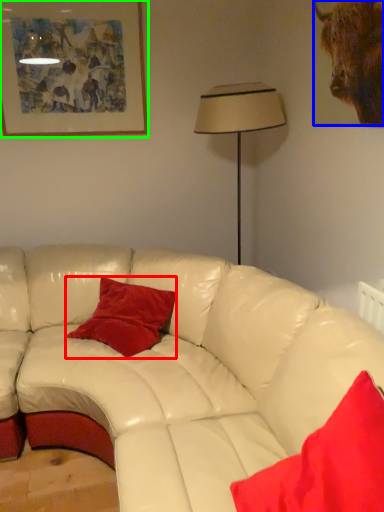
Question: Which object is the farthest from pillow (highlighted by a red box)? Choose among these: bull (highlighted by a blue box) or picture frame (highlighted by a green box).

Choices:
 (A) bull
 (B) picture frame

Answer: (A)